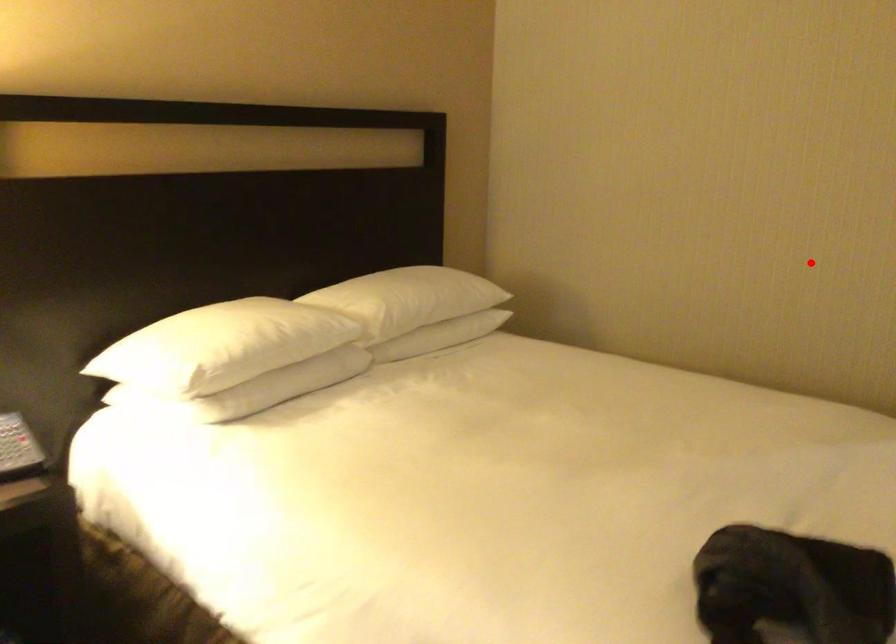
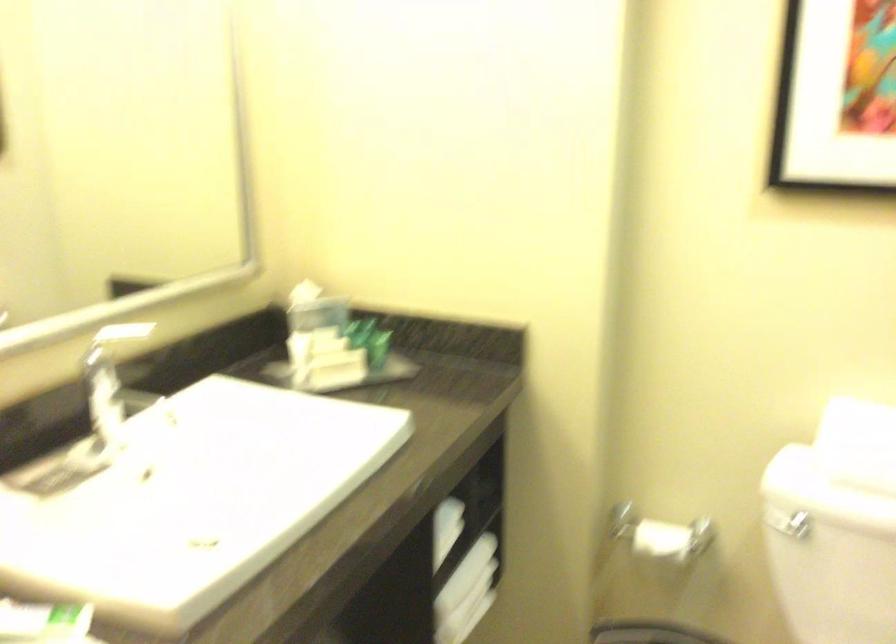
Question: I am providing you with two images of the same scene from different viewpoints. Given a red point in image1, look at the same physical point in image2. Is it:

Choices:
 (A) Closer to the viewpoint
 (B) Farther from the viewpoint

Answer: (A)